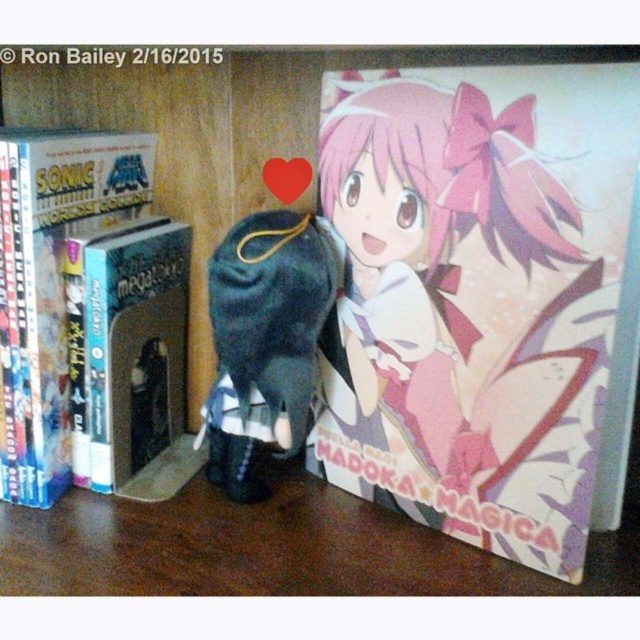
You are organizing a shelf and need to place a new item between the hardcover book at left and the velvet plush toy at center. The new item is 4 inches wide. Can it fit in the space between them?

The hardcover book at left is 8.82 inches away from the velvet plush toy at center, so a 4 inch wide item can fit in the space between them since 4 is less than 8.82.